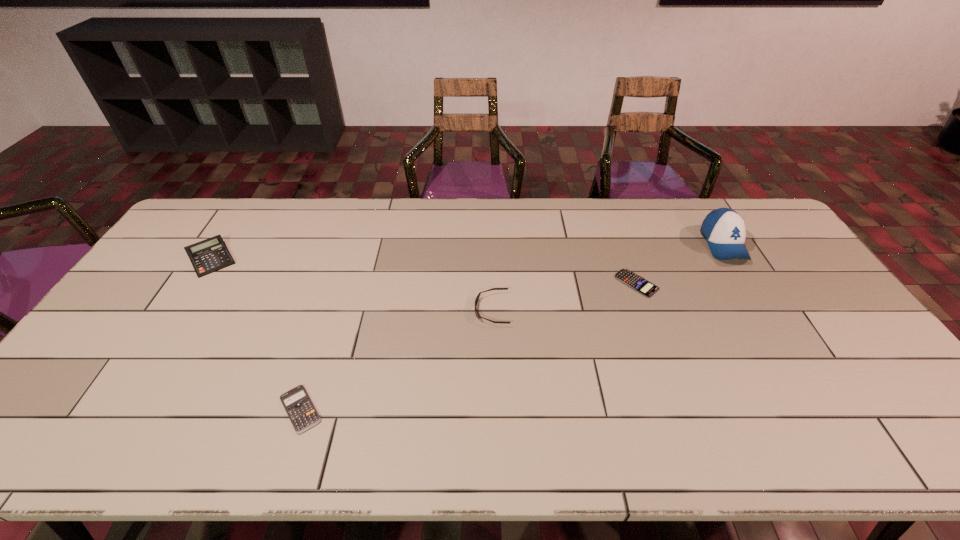
You are a GUI agent. You are given a task and a screenshot of the screen. Output one action in this format:
    pyautogui.click(x=<x>, y=<y>)
    Task: Click on the free space that satisfies the following two spatial constraints: 1. on the front side of the leftmost calculator; 2. on the left side of the rightmost calculator
    The width and height of the screenshot is (960, 540).
    Given the screenshot: What is the action you would take?
    pyautogui.click(x=196, y=284)

At what (x,y) coordinates should I click in order to perform the action: click on free space that satisfies the following two spatial constraints: 1. on the front side of the rightmost calculator; 2. on the left side of the leftmost object. Please return your answer as a coordinate pair (x, y). Image resolution: width=960 pixels, height=540 pixels. Looking at the image, I should click on (196, 284).